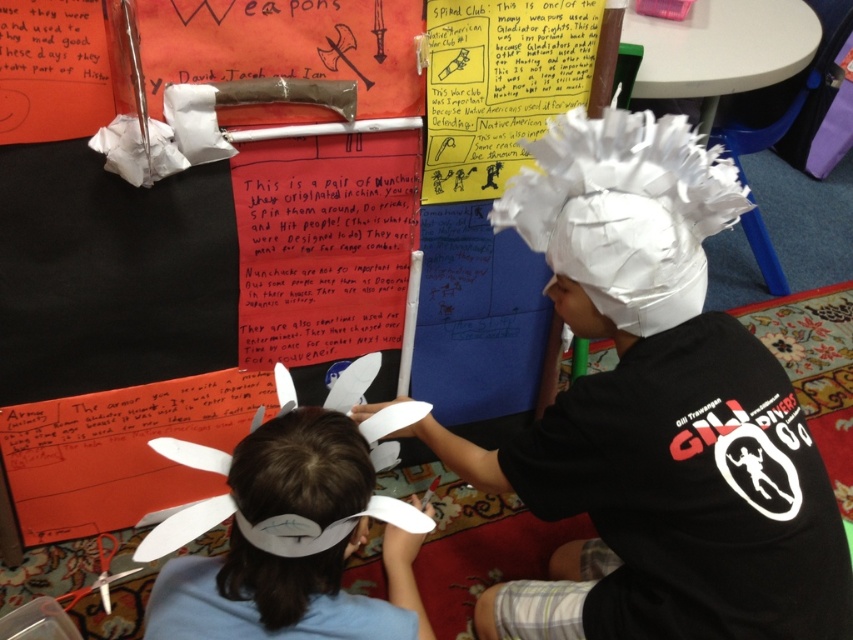
Describe the element at coordinates (654, 413) in the screenshot. I see `white paper hat at upper center` at that location.

Does white paper hat at upper center appear on the right side of white paper hat at lower left?

Indeed, white paper hat at upper center is positioned on the right side of white paper hat at lower left.

This screenshot has height=640, width=853. Identify the location of white paper hat at upper center. (654, 413).

At what (x,y) coordinates should I click in order to perform the action: click on white paper hat at upper center. Please return your answer as a coordinate pair (x, y). Looking at the image, I should click on (654, 413).